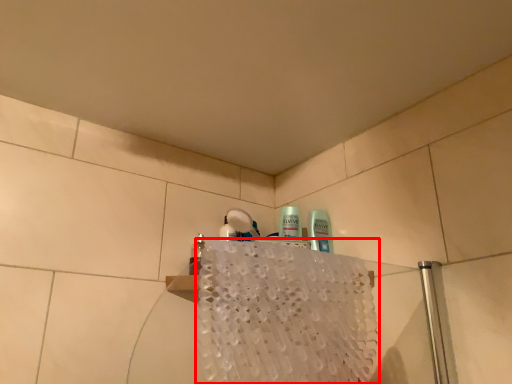
Question: From the image's perspective, what is the correct spatial positioning of bath towel (annotated by the red box) in reference to mouthwash?

Choices:
 (A) below
 (B) above

Answer: (A)